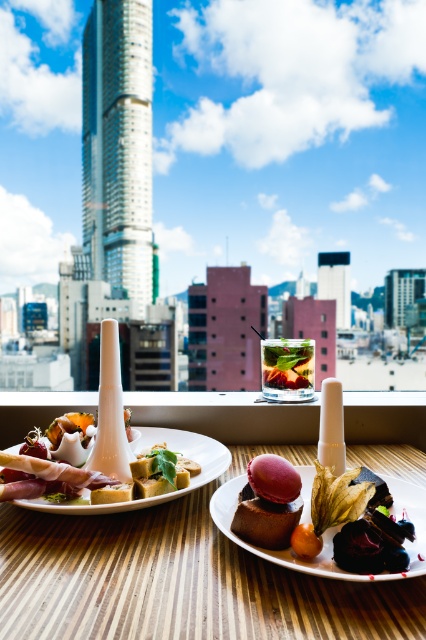
You are a guest at a formal dinner seated at the wooden table at center. You notice the chocolate cake at center is placed directly in front of you. Can you comfortably reach the cake without leaning over the table?

The wooden table at center is not as tall as chocolate cake at center, meaning the cake is taller than the table. Since the cake is placed in front of you and is taller than the table, reaching it might be difficult as it could obstruct your view or require leaning forward to access it.

You are a guest at this elegant dinner and want to place your napkin on the wooden table at center. However, there is a pink matte macaron at center nearby. Considering their heights, which one is shorter so you can place the napkin there without disturbing the macaron?

The wooden table at center is shorter than the pink matte macaron at center, so you can safely place your napkin on the wooden table at center without disturbing the macaron.